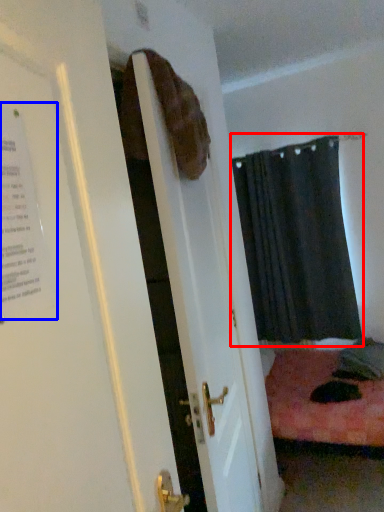
Question: Which of the following is the closest to the observer, curtain (highlighted by a red box) or poster (highlighted by a blue box)?

Choices:
 (A) curtain
 (B) poster

Answer: (B)